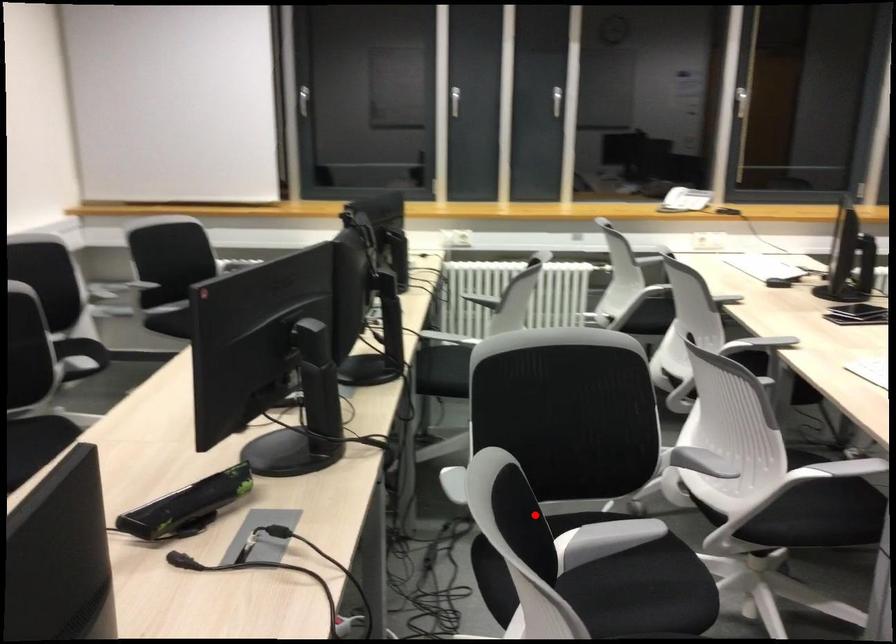
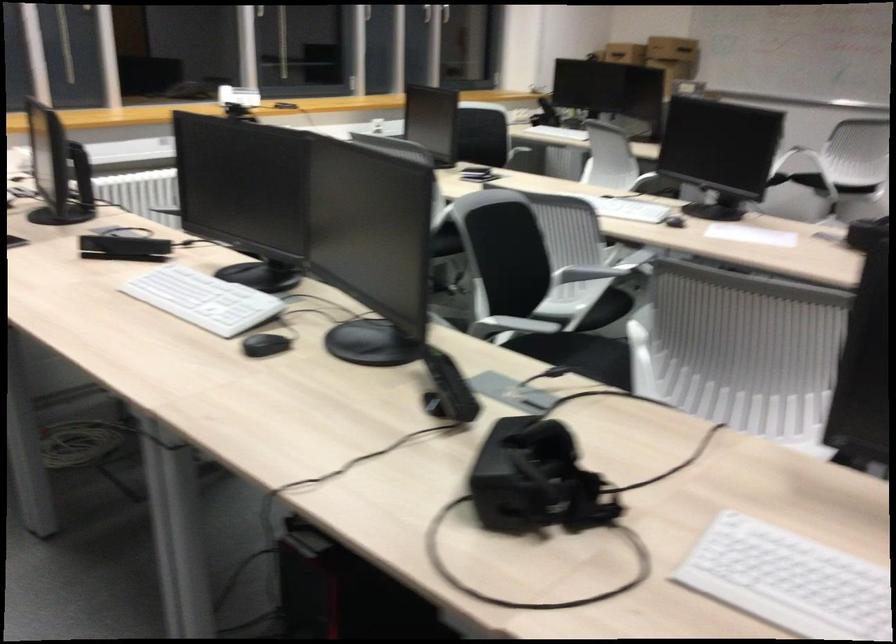
Locate, in the second image, the point that corresponds to the highlighted location in the first image.

(734, 277)